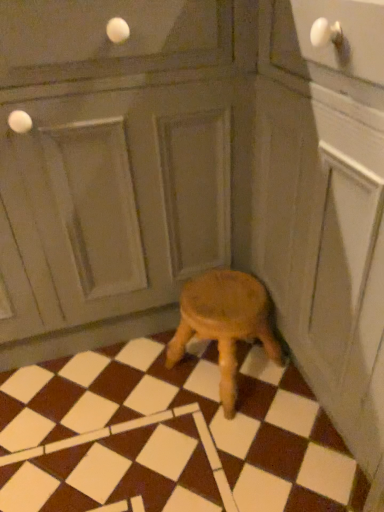
The width and height of the screenshot is (384, 512). Identify the location of brown matte tile at center. (168, 436).

Identify the location of matte gray screen door at center. (x=112, y=202).

Where is `brown matte tile at center`? This screenshot has height=512, width=384. brown matte tile at center is located at coordinates (168, 436).

Considering the positions of points (296, 500) and (120, 216), is point (296, 500) farther from camera compared to point (120, 216)?

No, (296, 500) is closer to viewer.

Which of these two, brown matte tile at center or matte gray screen door at center, is bigger?

matte gray screen door at center.

Considering the relative positions of brown matte tile at center and matte gray screen door at center in the image provided, is brown matte tile at center to the right of matte gray screen door at center from the viewer's perspective?

Yes, brown matte tile at center is to the right of matte gray screen door at center.

Are brown matte tile at center and matte gray screen door at center beside each other?

brown matte tile at center and matte gray screen door at center are not in contact.

Is brown matte tile at center outside of wooden stool at center?

Yes.

Is brown matte tile at center turned away from wooden stool at center?

That's not correct — brown matte tile at center is not looking away from wooden stool at center.

Considering the relative sizes of brown matte tile at center and wooden stool at center in the image provided, is brown matte tile at center thinner than wooden stool at center?

No.

Consider the image. Is wooden stool at center looking in the opposite direction of brown matte tile at center?

Correct, wooden stool at center is looking away from brown matte tile at center.

Considering the relative positions of wooden stool at center and brown matte tile at center in the image provided, is wooden stool at center to the left of brown matte tile at center from the viewer's perspective?

In fact, wooden stool at center is to the right of brown matte tile at center.

In the scene shown: Can brown matte tile at center be found inside wooden stool at center?

That's incorrect, brown matte tile at center is not inside wooden stool at center.

This screenshot has height=512, width=384. In order to click on stool below the matte gray screen door at center (from a real-world perspective) in this screenshot , I will do `click(225, 323)`.

Considering the points (168, 282) and (228, 384), which point is in front, point (168, 282) or point (228, 384)?

Positioned in front is point (228, 384).

Which object is positioned more to the right, matte gray screen door at center or wooden stool at center?

From the viewer's perspective, wooden stool at center appears more on the right side.

Considering the relative sizes of matte gray screen door at center and wooden stool at center in the image provided, is matte gray screen door at center shorter than wooden stool at center?

No, matte gray screen door at center is not shorter than wooden stool at center.

Can we say matte gray screen door at center lies outside brown matte tile at center?

Absolutely, matte gray screen door at center is external to brown matte tile at center.

Which of these two, matte gray screen door at center or brown matte tile at center, is wider?

brown matte tile at center.

Can you see matte gray screen door at center touching brown matte tile at center?

matte gray screen door at center and brown matte tile at center are not in contact.

Relative to matte gray screen door at center, is wooden stool at center in front or behind?

Visually, wooden stool at center is located behind matte gray screen door at center.

From the image's perspective, is wooden stool at center on top of matte gray screen door at center?

No.

Can you confirm if wooden stool at center is shorter than matte gray screen door at center?

Correct, wooden stool at center is not as tall as matte gray screen door at center.

Which of these two, wooden stool at center or matte gray screen door at center, is smaller?

wooden stool at center.

Identify the location of tile below the matte gray screen door at center (from a real-world perspective). The width and height of the screenshot is (384, 512). (168, 436).

Locate an element on the screen. The height and width of the screenshot is (512, 384). stool below the brown matte tile at center (from the image's perspective) is located at coordinates (225, 323).

Estimate the real-world distances between objects in this image. Which object is further from wooden stool at center, matte gray screen door at center or brown matte tile at center?

Among the two, matte gray screen door at center is located further to wooden stool at center.

Which object lies nearer to the anchor point brown matte tile at center, matte gray screen door at center or wooden stool at center?

Among the two, wooden stool at center is located nearer to brown matte tile at center.

Considering their positions, is wooden stool at center positioned further to matte gray screen door at center than brown matte tile at center?

brown matte tile at center lies further to matte gray screen door at center than the other object.

From the picture: Which object lies nearer to the anchor point wooden stool at center, brown matte tile at center or matte gray screen door at center?

The object closer to wooden stool at center is brown matte tile at center.

Looking at the image, which one is located closer to matte gray screen door at center, brown matte tile at center or wooden stool at center?

wooden stool at center.

Estimate the real-world distances between objects in this image. Which object is further from brown matte tile at center, wooden stool at center or matte gray screen door at center?

matte gray screen door at center is positioned further to the anchor brown matte tile at center.

Image resolution: width=384 pixels, height=512 pixels. Identify the location of tile that lies between matte gray screen door at center and wooden stool at center from top to bottom. (168, 436).